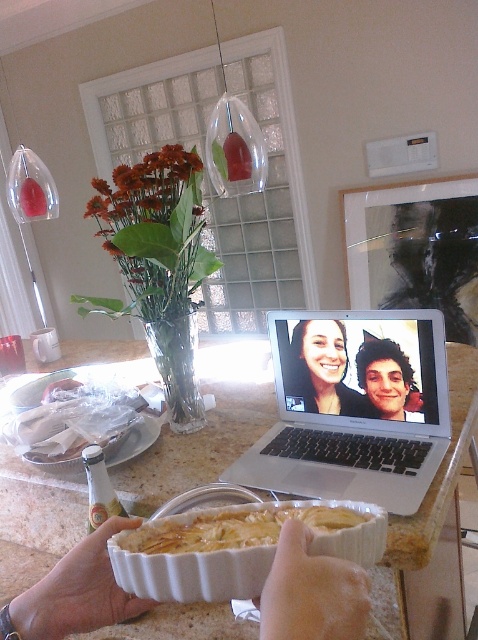
How distant is white matte hand at center from matte black hair at center?

white matte hand at center and matte black hair at center are 27.84 inches apart.

Does white matte hand at center have a lesser height compared to matte black hair at center?

Correct, white matte hand at center is not as tall as matte black hair at center.

What do you see at coordinates (77, 592) in the screenshot? Image resolution: width=478 pixels, height=640 pixels. I see `white matte hand at center` at bounding box center [77, 592].

The width and height of the screenshot is (478, 640). I want to click on white matte hand at center, so click(x=77, y=592).

Between granite countertop at center and white matte hand at center, which one is positioned lower?

Positioned lower is white matte hand at center.

Which of these two, granite countertop at center or white matte hand at center, stands shorter?

Standing shorter between the two is white matte hand at center.

Does point (25, 516) come closer to viewer compared to point (108, 563)?

No, (25, 516) is behind (108, 563).

Find the location of a particular element. This screenshot has height=640, width=478. granite countertop at center is located at coordinates (433, 524).

Can you confirm if granite countertop at center is taller than white ceramic dish at center?

Indeed, granite countertop at center has a greater height compared to white ceramic dish at center.

Does granite countertop at center appear on the left side of white ceramic dish at center?

Correct, you'll find granite countertop at center to the left of white ceramic dish at center.

Which is in front, point (65, 365) or point (270, 577)?

Point (270, 577) is more forward.

Image resolution: width=478 pixels, height=640 pixels. Find the location of `granite countertop at center`. granite countertop at center is located at coordinates (433, 524).